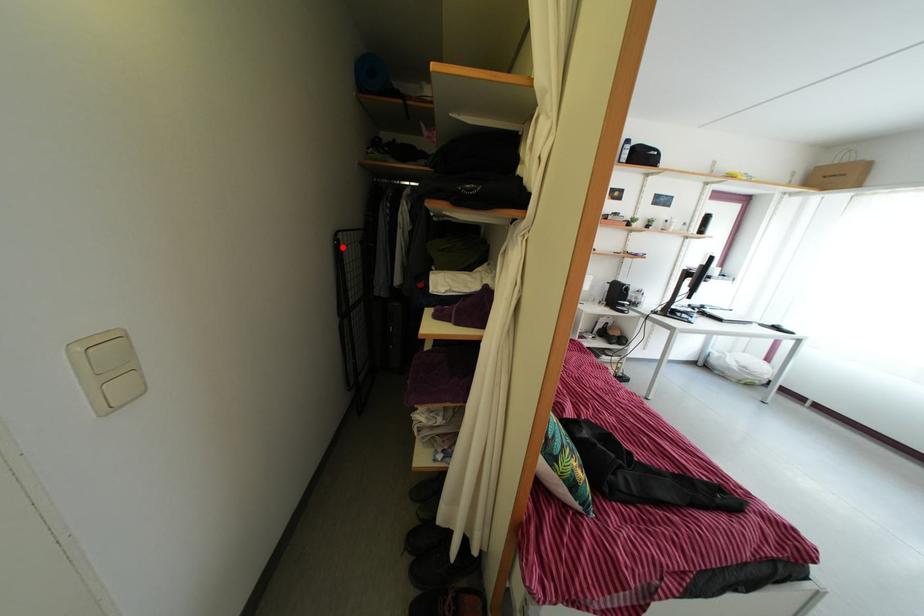
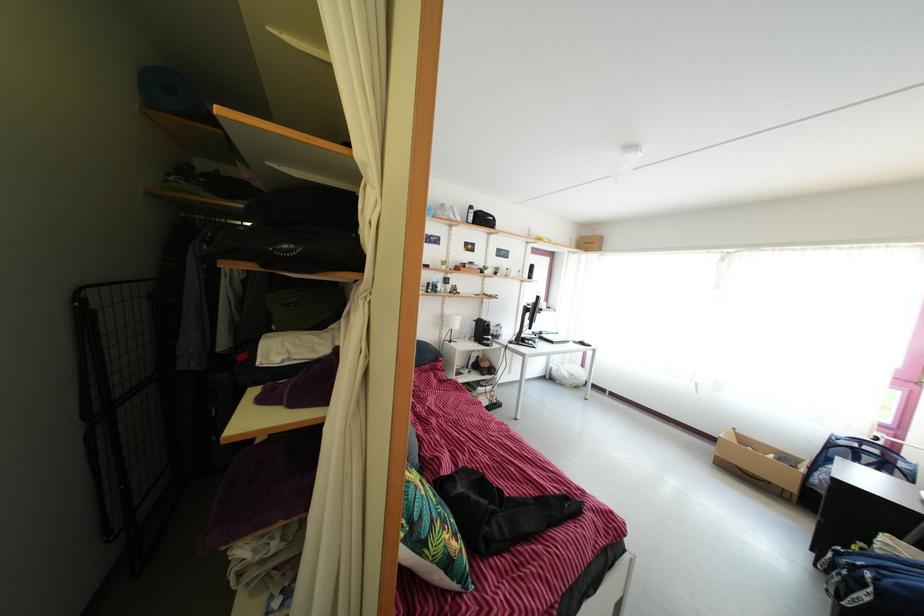
Find the pixel in the second image that matches the highlighted location in the first image.

(86, 307)